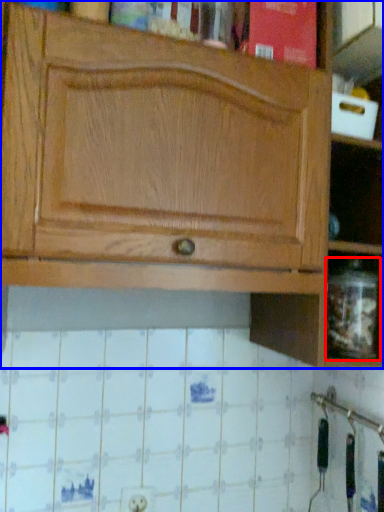
Question: Which point is closer to the camera, glass jar (highlighted by a red box) or cabinetry (highlighted by a blue box)?

Choices:
 (A) glass jar
 (B) cabinetry

Answer: (B)